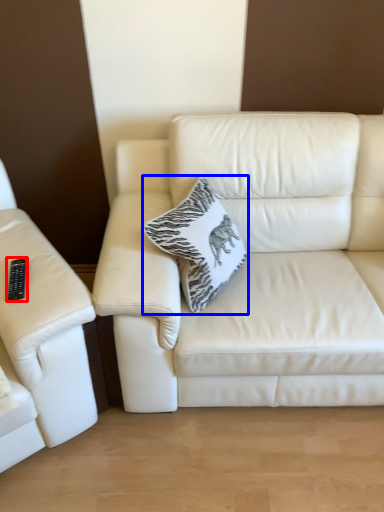
Question: Which object appears closest to the camera in this image, remote (highlighted by a red box) or throw pillow (highlighted by a blue box)?

Choices:
 (A) remote
 (B) throw pillow

Answer: (A)